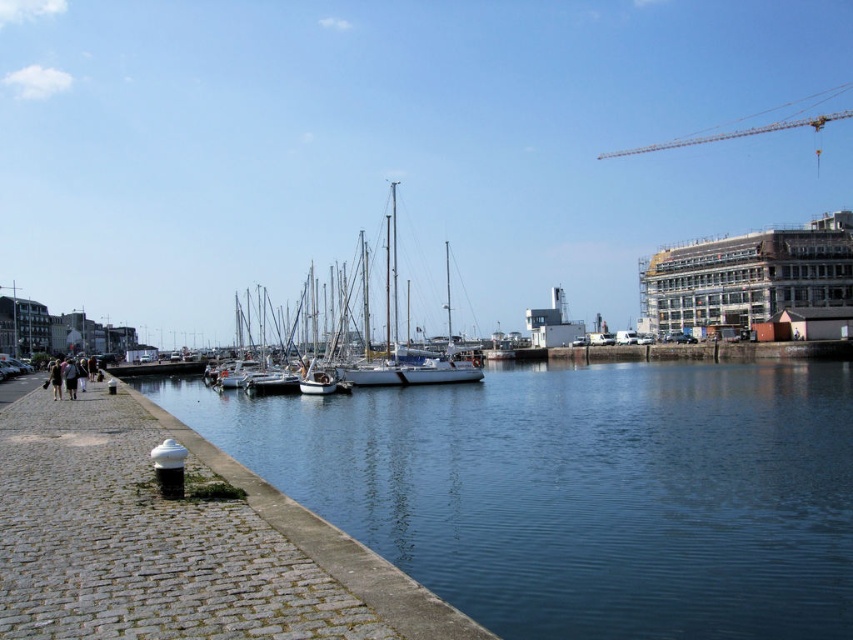
Does blue smooth water at lower left have a greater width compared to white glossy sailboat at center?

Yes.

Is blue smooth water at lower left taller than white glossy sailboat at center?

Incorrect, blue smooth water at lower left's height is not larger of white glossy sailboat at center's.

Is point (439, 401) positioned in front of point (465, 372)?

Yes, point (439, 401) is closer to viewer.

In order to click on blue smooth water at lower left in this screenshot , I will do `click(579, 490)`.

Which of these two, white glossy sailboat at center or metallic silver crane at upper right, stands shorter?

Standing shorter between the two is metallic silver crane at upper right.

Does white glossy sailboat at center appear over metallic silver crane at upper right?

Incorrect, white glossy sailboat at center is not positioned above metallic silver crane at upper right.

Locate an element on the screen. The image size is (853, 640). white glossy sailboat at center is located at coordinates (370, 326).

Between blue smooth water at lower left and metallic silver crane at upper right, which one is positioned higher?

metallic silver crane at upper right

Is blue smooth water at lower left to the left of metallic silver crane at upper right from the viewer's perspective?

Correct, you'll find blue smooth water at lower left to the left of metallic silver crane at upper right.

The width and height of the screenshot is (853, 640). Describe the element at coordinates (579, 490) in the screenshot. I see `blue smooth water at lower left` at that location.

This screenshot has width=853, height=640. Identify the location of blue smooth water at lower left. (579, 490).